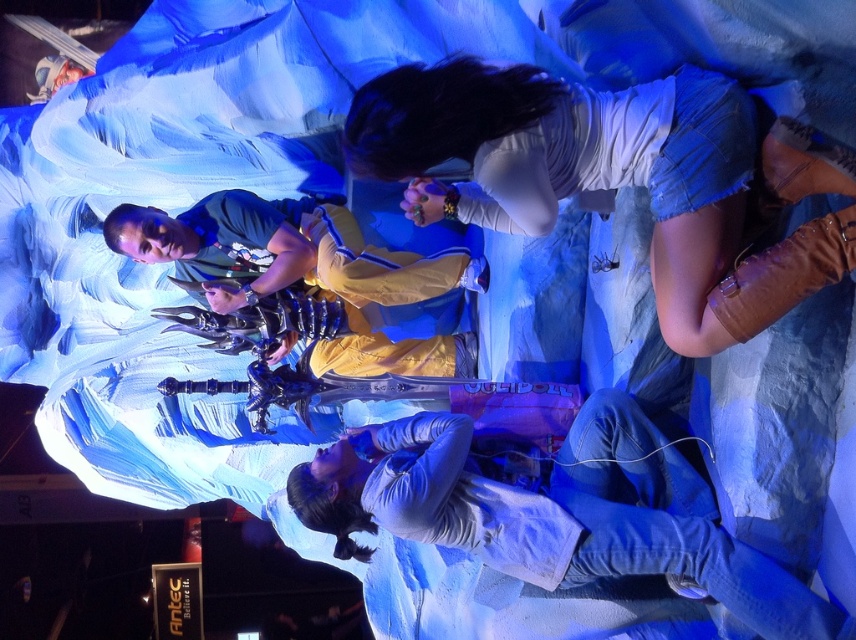
Question: Among these points, which one is nearest to the camera?

Choices:
 (A) (738, 145)
 (B) (589, 556)
 (C) (402, 298)

Answer: (A)

Question: Does white matte shirt at lower center appear over matte yellow jacket at center?

Choices:
 (A) no
 (B) yes

Answer: (A)

Question: Does denim shorts at upper right have a greater width compared to white matte shirt at lower center?

Choices:
 (A) no
 (B) yes

Answer: (A)

Question: Among these points, which one is farthest from the camera?

Choices:
 (A) (813, 177)
 (B) (444, 516)

Answer: (B)

Question: Can you confirm if denim shorts at upper right is smaller than white matte shirt at lower center?

Choices:
 (A) no
 (B) yes

Answer: (A)

Question: Estimate the real-world distances between objects in this image. Which object is farther from the white matte shirt at lower center?

Choices:
 (A) matte yellow jacket at center
 (B) denim shorts at upper right

Answer: (A)